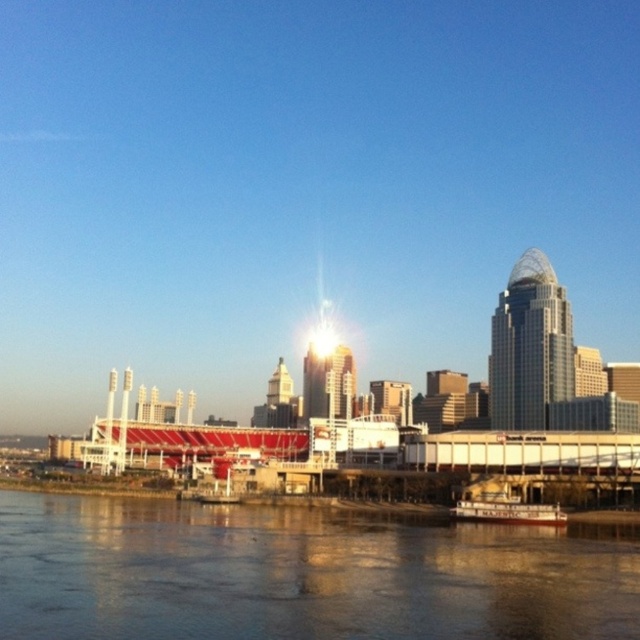
Does brown smooth water at lower center have a larger size compared to white wooden boat at lower center?

Indeed, brown smooth water at lower center has a larger size compared to white wooden boat at lower center.

Who is more forward, (147, 624) or (492, 518)?

Point (147, 624) is more forward.

You are a GUI agent. You are given a task and a screenshot of the screen. Output one action in this format:
    pyautogui.click(x=<x>, y=<y>)
    Task: Click on the brown smooth water at lower center
    
    Given the screenshot: What is the action you would take?
    pyautogui.click(x=301, y=573)